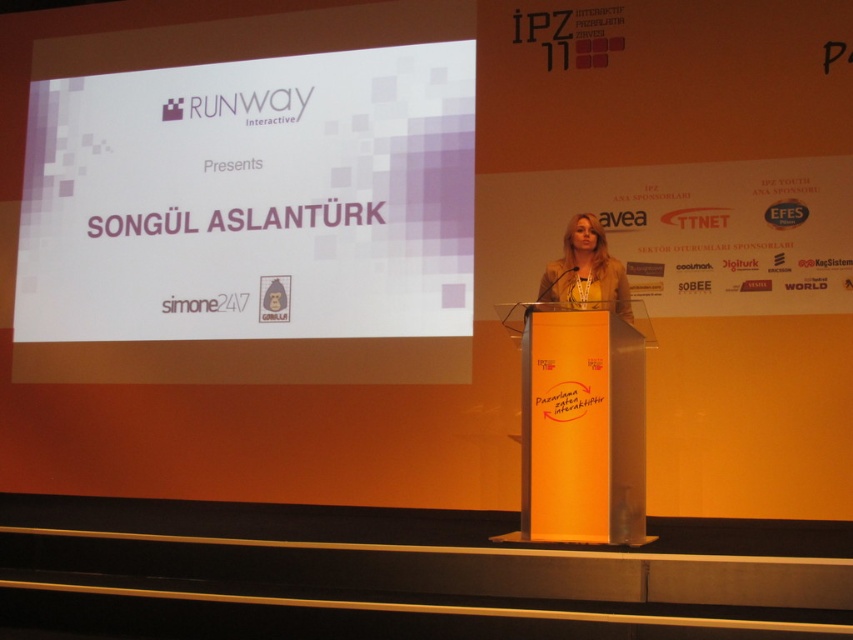
You are an event planner setting up for a presentation. You need to ensure that the white matte screen at upper center and the orange glossy podium at center are positioned so that the screen is visible to all attendees. Given their heights, which object should be placed higher to ensure visibility?

The white matte screen at upper center should be placed higher since it has a greater height compared to the orange glossy podium at center, ensuring it is visible to all attendees.

You are an event planner setting up for a presentation. You need to ensure the projector is angled so it can project onto the white matte screen at upper center without obstruction from the orange glossy podium at center. Based on their positions, will the podium block the projection?

The white matte screen at upper center is located above the orange glossy podium at center, so the podium will not block the projection since it is positioned below the screen.